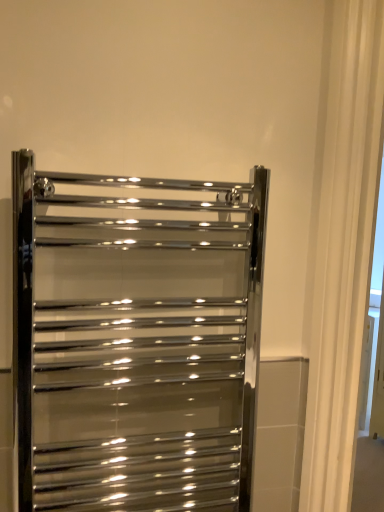
Describe the element at coordinates (135, 343) in the screenshot. Image resolution: width=384 pixels, height=512 pixels. I see `polished chrome towel rack at center` at that location.

This screenshot has height=512, width=384. What are the coordinates of `polished chrome towel rack at center` in the screenshot? It's located at (135, 343).

Find the location of `polished chrome towel rack at center`. polished chrome towel rack at center is located at coordinates click(x=135, y=343).